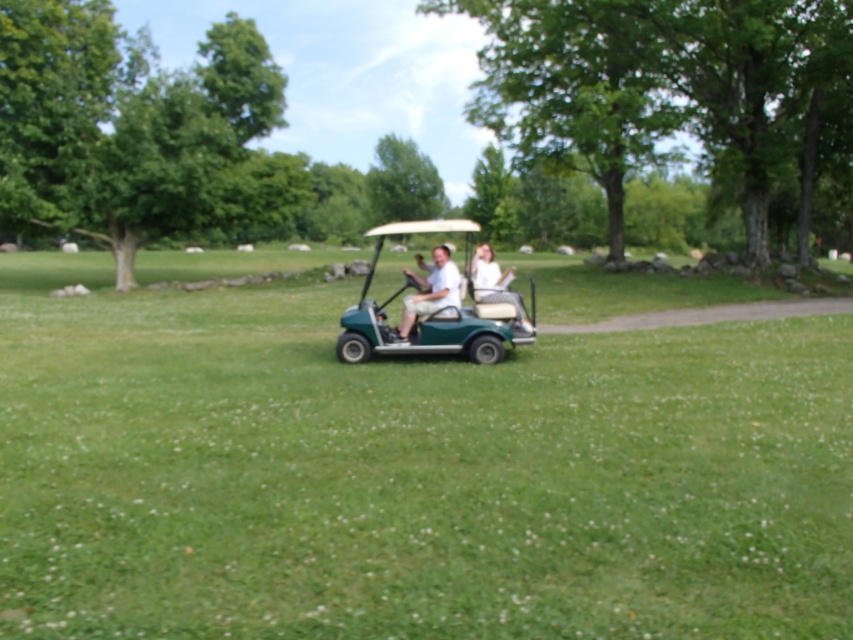
You are planning to park two golf carts in a row in a narrow parking space. The green plastic golf cart at center and the white matte golf cart at center are both available. Which one should you choose to fit better in the space?

The white matte golf cart at center should be chosen because it has a smaller width compared to the green plastic golf cart at center, making it more suitable for narrow spaces.

Based on the photo, you are standing on the golf course and see the matte green golf cart at center and the white fabric shirt at center. Which object is closer to you?

The matte green golf cart at center is closer to you than the white fabric shirt at center because it is further to the viewer.

You are a photographer standing at the edge of the grassy field. You want to take a photo of the matte green golf cart at center and the white fabric shirt at center. If your camera has a minimum focus distance of 5 feet, will you be able to capture both subjects clearly in one shot?

The matte green golf cart at center is 5.85 feet from white fabric shirt at center. Since the distance between them is 5.85 feet, which is greater than the camera minimum focus distance of 5 feet, you can capture both subjects clearly in one shot.